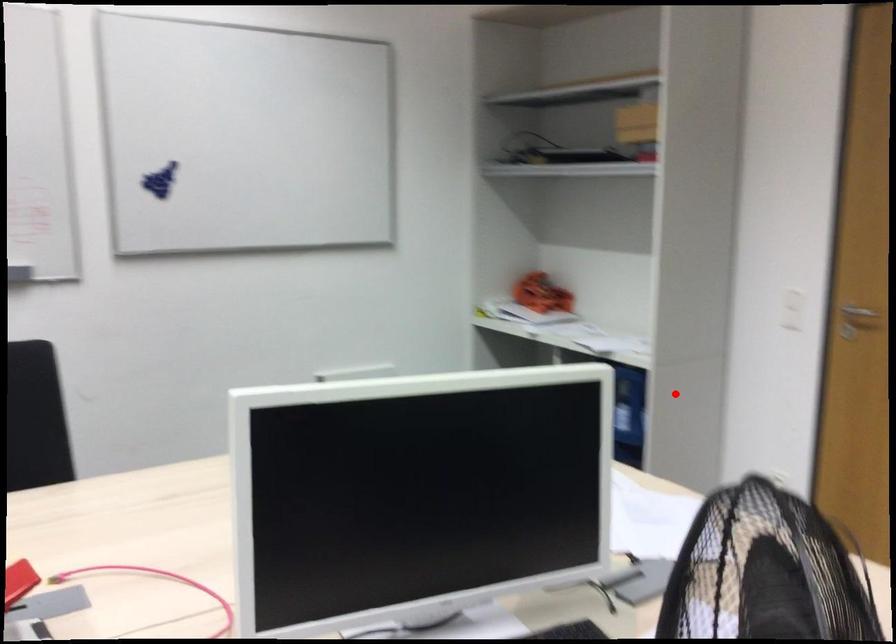
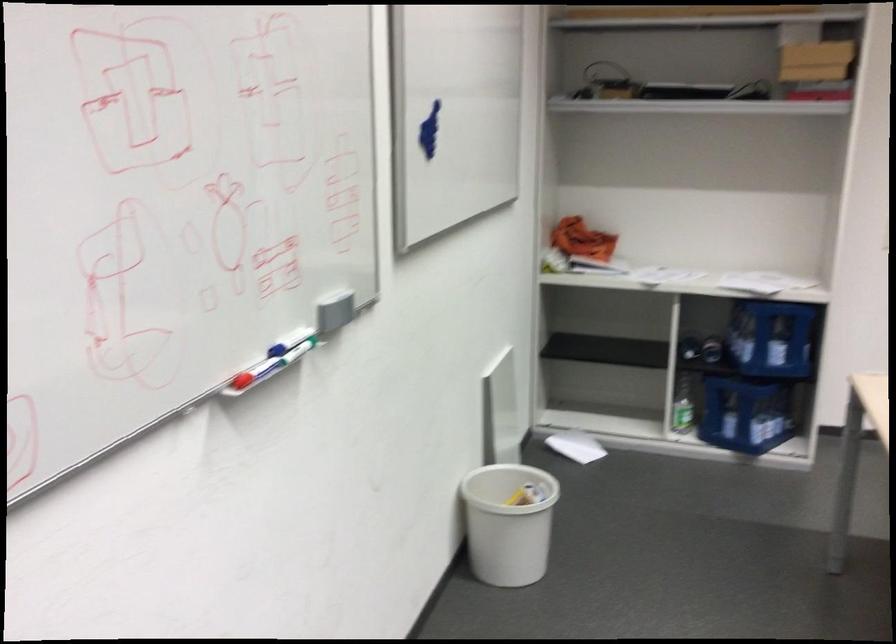
Where in the second image is the point corresponding to the highlighted location from the first image?

(771, 337)